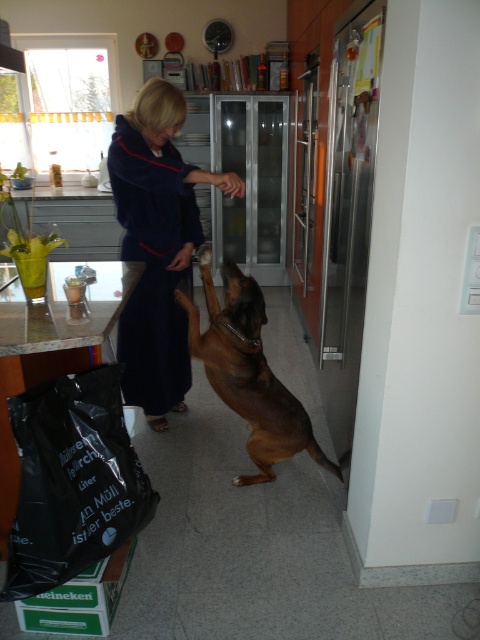
You are standing in the kitchen and want to reach two points marked in the scene. Which of the two points, point (168, 179) or point (316, 445), is closer to you?

Point (168, 179) is closer to the viewer than point (316, 445).